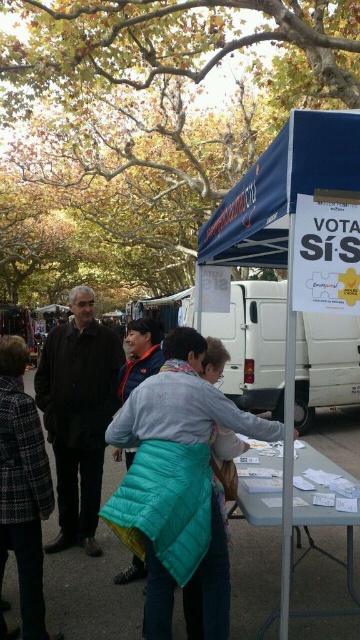
You are standing at the point closer to the camera in the scene. There are two points marked in the image, one at coordinates point (160, 554) and the other at point (325, 128). Which point are you currently standing at?

You are standing at point (160, 554) because it is further to the camera than point (325, 128).